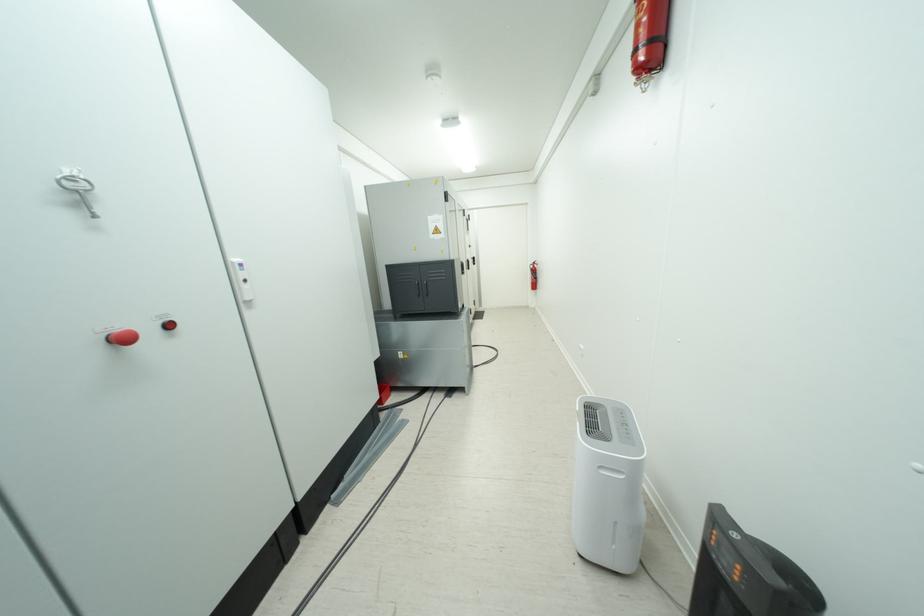
Which object does [532,275] point to?

It refers to a red fire extinguisher.